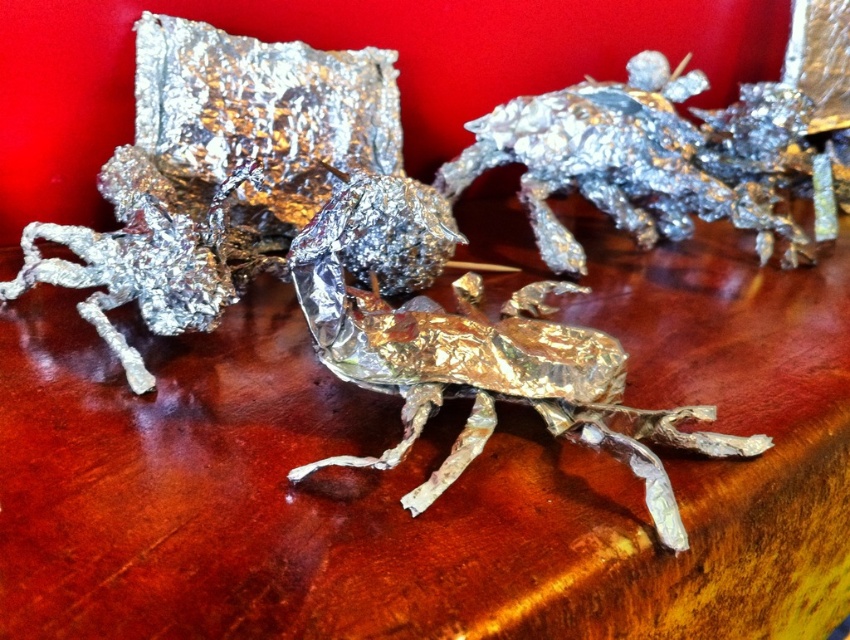
Between gold foil insect at center and shiny metallic crab at center, which one is positioned lower?

gold foil insect at center is lower down.

Is gold foil insect at center above shiny metallic crab at center?

Actually, gold foil insect at center is below shiny metallic crab at center.

Describe the element at coordinates (469, 346) in the screenshot. I see `gold foil insect at center` at that location.

At what (x,y) coordinates should I click in order to perform the action: click on gold foil insect at center. Please return your answer as a coordinate pair (x, y). This screenshot has width=850, height=640. Looking at the image, I should click on (469, 346).

Who is taller, shiny metallic crab at center or shiny metallic insect at center-left?

shiny metallic crab at center

Identify the location of shiny metallic crab at center. This screenshot has height=640, width=850. (658, 160).

Find the location of a particular element. The image size is (850, 640). gold foil insect at center is located at coordinates (469, 346).

Which is more to the right, gold foil insect at center or shiny metallic insect at center-left?

From the viewer's perspective, gold foil insect at center appears more on the right side.

Who is more distant from viewer, (409, 248) or (51, 260)?

The point (409, 248) is more distant.

Find the location of a particular element. The height and width of the screenshot is (640, 850). gold foil insect at center is located at coordinates (469, 346).